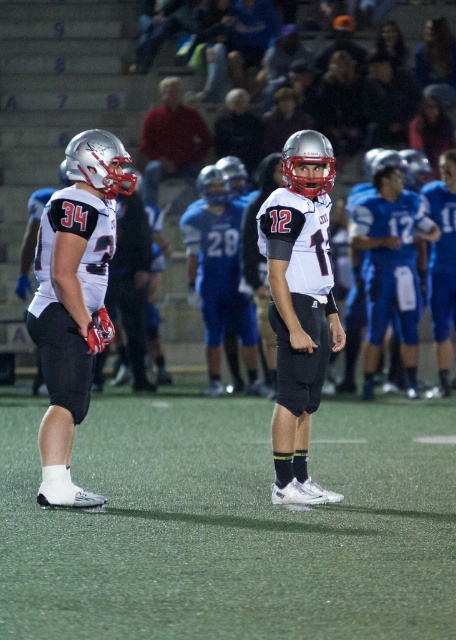
Question: Which point is farther from the camera taking this photo?

Choices:
 (A) (419, 512)
 (B) (41, 337)
 (C) (415, 326)
 (D) (290, 438)

Answer: (C)

Question: Does white matte jersey at center lie behind red fabric shirt at upper center?

Choices:
 (A) no
 (B) yes

Answer: (A)

Question: Considering the relative positions of white matte jersey at left and red fabric shirt at upper center in the image provided, where is white matte jersey at left located with respect to red fabric shirt at upper center?

Choices:
 (A) right
 (B) left

Answer: (B)

Question: Which object is the farthest from the green artificial turf at center?

Choices:
 (A) white matte jersey at center
 (B) red fabric shirt at upper center

Answer: (B)

Question: Which point appears closest to the camera in this image?

Choices:
 (A) (376, 291)
 (B) (212, 584)
 (C) (290, 312)
 (D) (253, 156)

Answer: (B)

Question: Does green artificial turf at center appear on the left side of white matte jersey at left?

Choices:
 (A) yes
 (B) no

Answer: (B)